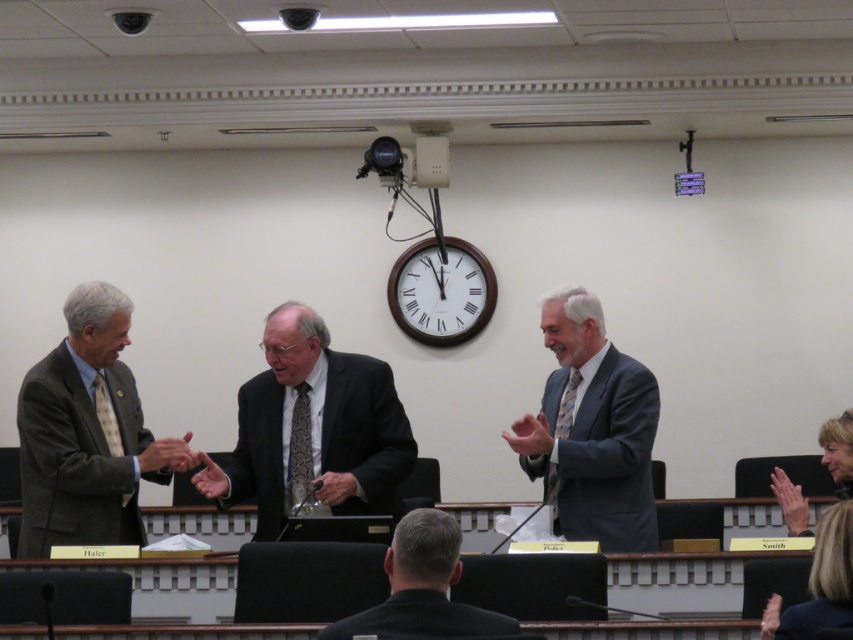
How distant is matte brown suit at left from black suit at center?

matte brown suit at left and black suit at center are 1.84 meters apart from each other.

Which is above, matte brown suit at left or black suit at center?

matte brown suit at left is above.

Between point (44, 518) and point (410, 513), which one is positioned in front?

Point (410, 513)

You are a GUI agent. You are given a task and a screenshot of the screen. Output one action in this format:
    pyautogui.click(x=<x>, y=<y>)
    Task: Click on the matte brown suit at left
    The image size is (853, 640).
    Given the screenshot: What is the action you would take?
    pyautogui.click(x=86, y=433)

Who is more distant from viewer, (x=41, y=419) or (x=624, y=488)?

The point (x=624, y=488) is behind.

Which is in front, point (74, 467) or point (548, 410)?

Positioned in front is point (74, 467).

Where is `matte brown suit at left`? The image size is (853, 640). matte brown suit at left is located at coordinates (86, 433).

Is dark gray suit at center smaller than black suit at center?

Actually, dark gray suit at center might be larger than black suit at center.

Between dark gray suit at center and black suit at center, which one appears on the left side from the viewer's perspective?

From the viewer's perspective, dark gray suit at center appears more on the left side.

Locate an element on the screen. This screenshot has height=640, width=853. dark gray suit at center is located at coordinates (312, 428).